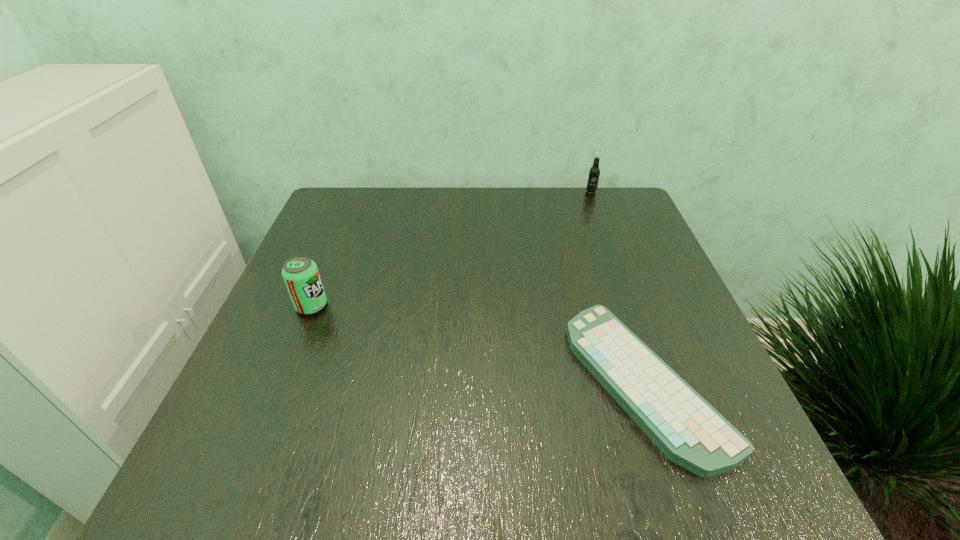
Where is `the farthest object`? This screenshot has height=540, width=960. the farthest object is located at coordinates (593, 177).

Where is `pop soda`? The image size is (960, 540). pop soda is located at coordinates (301, 276).

Locate an element on the screen. This screenshot has width=960, height=540. the shortest object is located at coordinates (691, 433).

The height and width of the screenshot is (540, 960). I want to click on blank space located on the label of the root beer, so click(x=602, y=219).

This screenshot has width=960, height=540. What are the coordinates of `vacant area located on the front-facing side of the leftmost object` in the screenshot? It's located at click(x=371, y=306).

In order to click on free space located on the back of the computer keyboard in this screenshot , I will do `click(604, 260)`.

The width and height of the screenshot is (960, 540). Find the location of `object located at the far edge`. object located at the far edge is located at coordinates click(x=593, y=177).

What are the coordinates of `object present at the near edge` in the screenshot? It's located at (691, 433).

Image resolution: width=960 pixels, height=540 pixels. What are the coordinates of `object present at the left edge` in the screenshot? It's located at (301, 276).

Identify the location of root beer situated at the right edge. (593, 177).